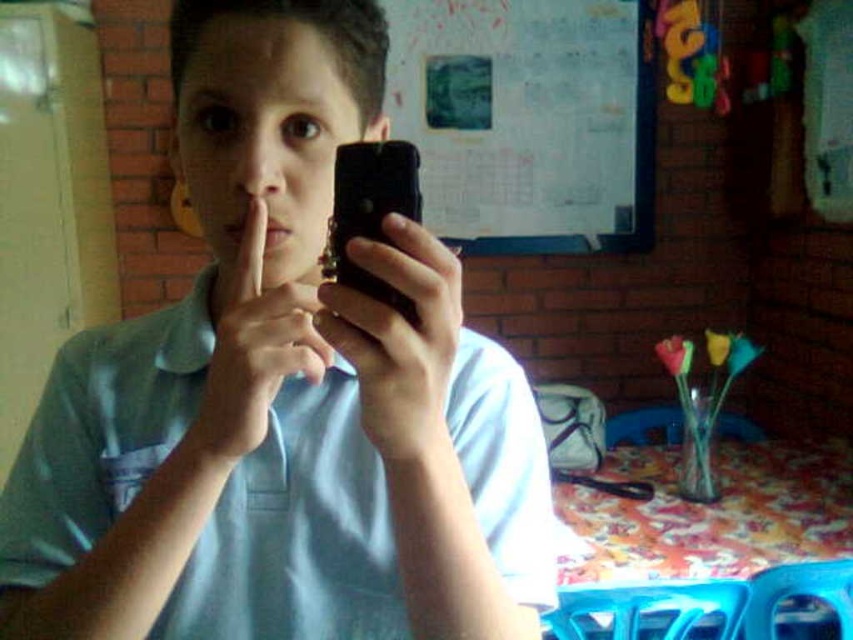
You are a photographer trying to frame a shot of the white paper at upper center and the matte skin at center. Which object should you adjust your camera to focus on first if you want to capture both in the same frame without cropping?

The white paper at upper center has a larger width than the matte skin at center, so you should focus on the white paper at upper center first to ensure it fits properly before adjusting for the matte skin at center.

You are a photographer trying to adjust the framing of the image. The subject is wearing a matte blue shirt at center and holding a black matte smartphone at center. Based on their positions, which object should you move closer to the top of the frame to ensure the smartphone is the main focus?

The matte blue shirt at center is below the black matte smartphone at center, so to make the smartphone the main focus, move the matte blue shirt at center downward or adjust the framing so the black matte smartphone at center remains higher in the frame.